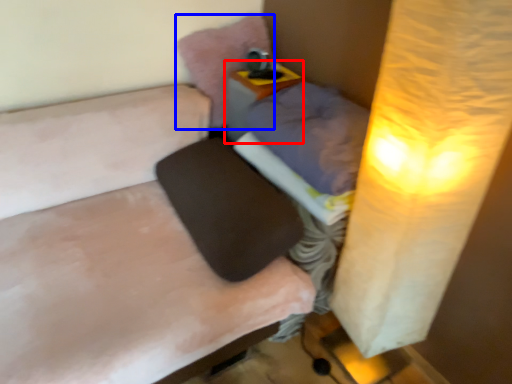
Question: Which of the following is the closest to the observer, table (highlighted by a red box) or pillow (highlighted by a blue box)?

Choices:
 (A) table
 (B) pillow

Answer: (A)